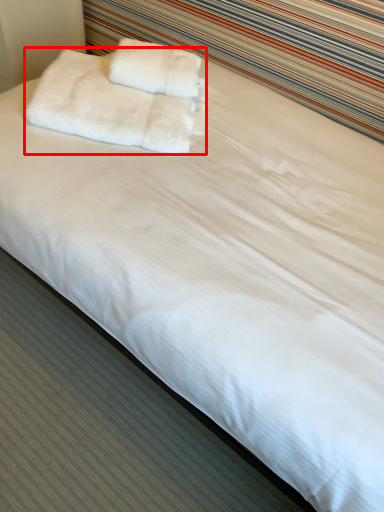
Question: From the image's perspective, considering the relative positions of towel (annotated by the red box) and towel in the image provided, where is towel (annotated by the red box) located with respect to the staircase?

Choices:
 (A) below
 (B) above

Answer: (A)